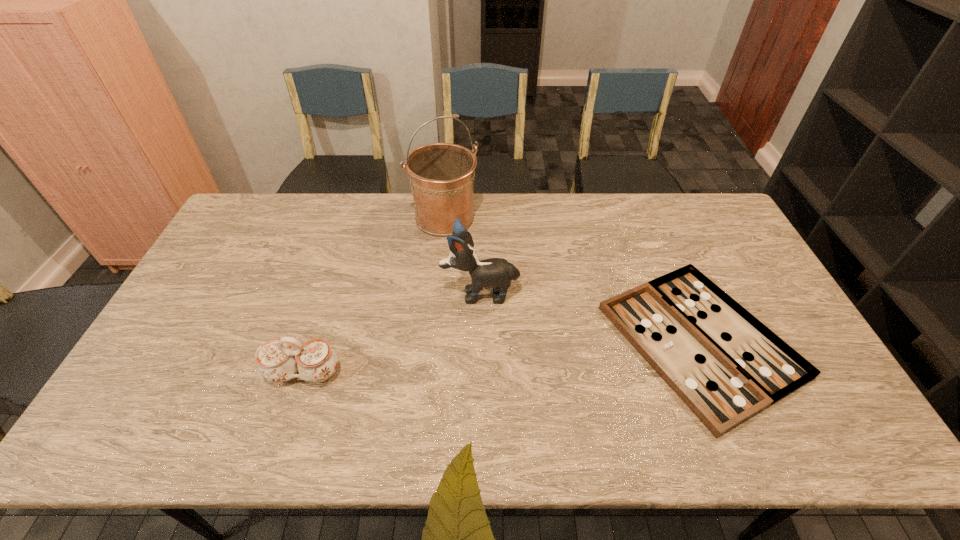
Locate an element on the screen. This screenshot has width=960, height=540. vacant region located on the front-facing side of the puppy is located at coordinates (408, 293).

Locate an element on the screen. This screenshot has height=540, width=960. free space located by the handle of the chinaware is located at coordinates (279, 450).

I want to click on vacant position located 0.320m on the back of the shortest object, so (644, 208).

The image size is (960, 540). I want to click on object present at the far edge, so click(x=441, y=175).

This screenshot has width=960, height=540. Identify the location of object situated at the near edge. (726, 366).

At what (x,y) coordinates should I click in order to perform the action: click on object that is positioned at the right edge. Please return your answer as a coordinate pair (x, y). Image resolution: width=960 pixels, height=540 pixels. Looking at the image, I should click on (726, 366).

Where is `object that is at the near right corner`? object that is at the near right corner is located at coordinates (726, 366).

This screenshot has width=960, height=540. In order to click on vacant area at the far edge of the desktop in this screenshot , I will do `click(583, 205)`.

In the image, there is a desktop. Identify the location of vacant space at the near edge. This screenshot has height=540, width=960. (585, 428).

Find the location of a particular element. vacant region at the left edge of the desktop is located at coordinates (163, 401).